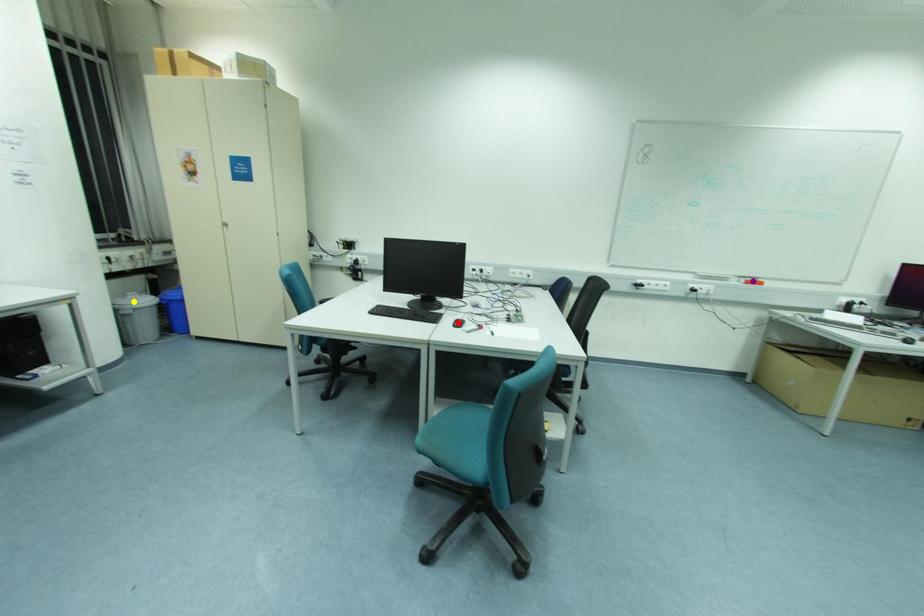
Order these from nearest to farthest:
purple point | yellow point | red point

red point, yellow point, purple point